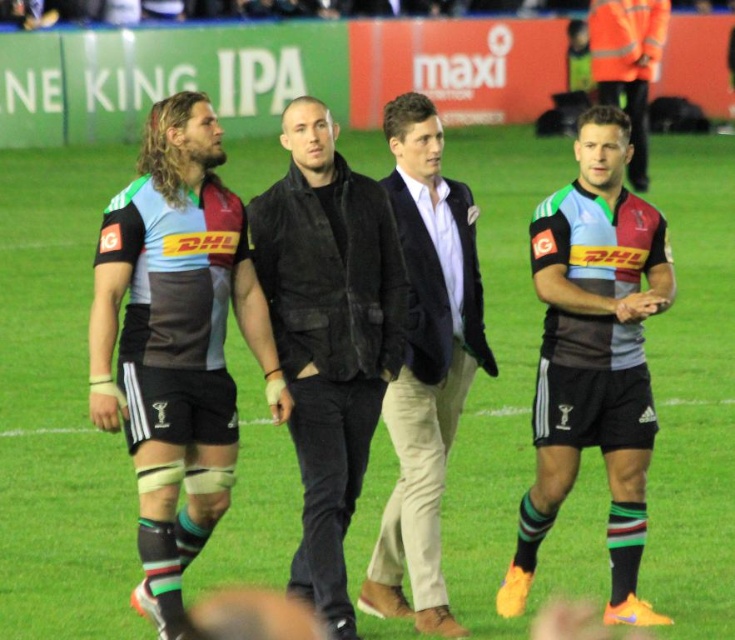
Who is more forward, (x=309, y=323) or (x=595, y=67)?

Positioned in front is point (x=309, y=323).

Is black leather jacket at center to the left of matte black shorts at right from the viewer's perspective?

Yes, black leather jacket at center is to the left of matte black shorts at right.

Between point (319, 202) and point (659, 19), which one is positioned in front?

Point (319, 202) is in front.

Where is `black leather jacket at center`? This screenshot has width=735, height=640. black leather jacket at center is located at coordinates (329, 333).

Is striped jersey at center bigger than light brown leather jacket at center?

Indeed, striped jersey at center has a larger size compared to light brown leather jacket at center.

Which is behind, point (595, 294) or point (448, 372)?

Point (448, 372)

Is point (609, 173) closer to camera compared to point (409, 321)?

That is True.

Where is `striped jersey at center`? striped jersey at center is located at coordinates (592, 356).

Who is taller, light brown leather jacket at center or matte black shorts at right?

With more height is matte black shorts at right.

Can you confirm if light brown leather jacket at center is wider than matte black shorts at right?

In fact, light brown leather jacket at center might be narrower than matte black shorts at right.

Who is more forward, (368, 608) or (637, 60)?

Point (368, 608)

Where is `light brown leather jacket at center`? This screenshot has height=640, width=735. light brown leather jacket at center is located at coordinates (426, 364).